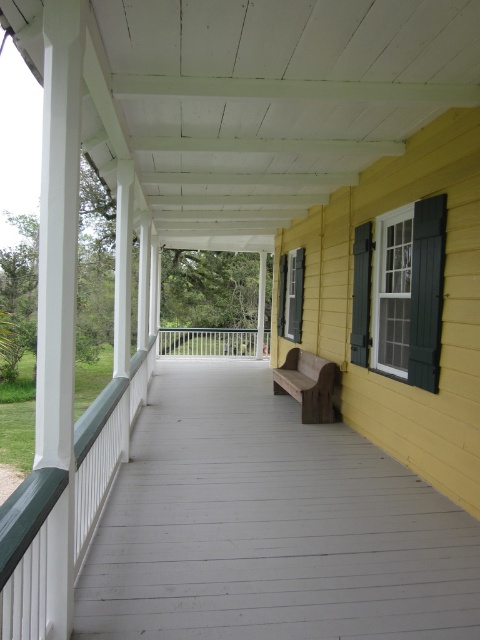
You are a painter who needs to decide whether to paint the wooden bench at center or the green painted wood shutter at upper right first. Since you want to start with the larger object, which one should you choose?

The wooden bench at center is larger than the green painted wood shutter at upper right, so you should paint the wooden bench at center first.

Consider the image. You are a painter who needs to decide which object to paint first. Based on the scene, which object is smaller in size between the white painted wood porch at center and the green matte shutter at right?

The white painted wood porch at center is smaller in size compared to the green matte shutter at right.